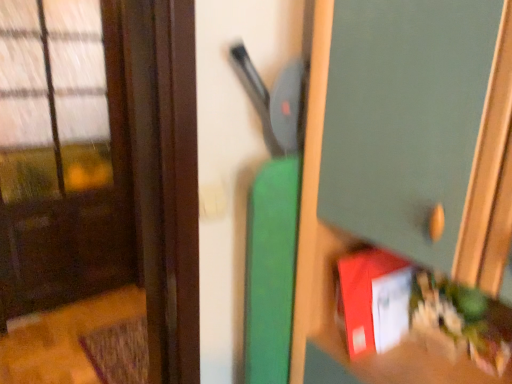
Question: From the image's perspective, is brown matte door at left located above or below matte red book at lower right, the 1th book positioned from the left?

Choices:
 (A) above
 (B) below

Answer: (A)

Question: Considering the positions of brown matte door at left and matte red book at lower right, the 1th book positioned from the left, in the image, is brown matte door at left taller or shorter than matte red book at lower right, the 1th book positioned from the left,?

Choices:
 (A) tall
 (B) short

Answer: (A)

Question: Which object is the farthest from the green matte cabinet at center?

Choices:
 (A) brown matte door at left
 (B) matte red book at lower right, the 2th book positioned from the right
 (C) red matte book at lower right, which is counted as the first book, starting from the right

Answer: (A)

Question: Which object is the closest to the brown matte door at left?

Choices:
 (A) matte red book at lower right, the 2th book positioned from the right
 (B) green matte cabinet at center
 (C) red matte book at lower right, which is counted as the 2th book, starting from the left

Answer: (C)